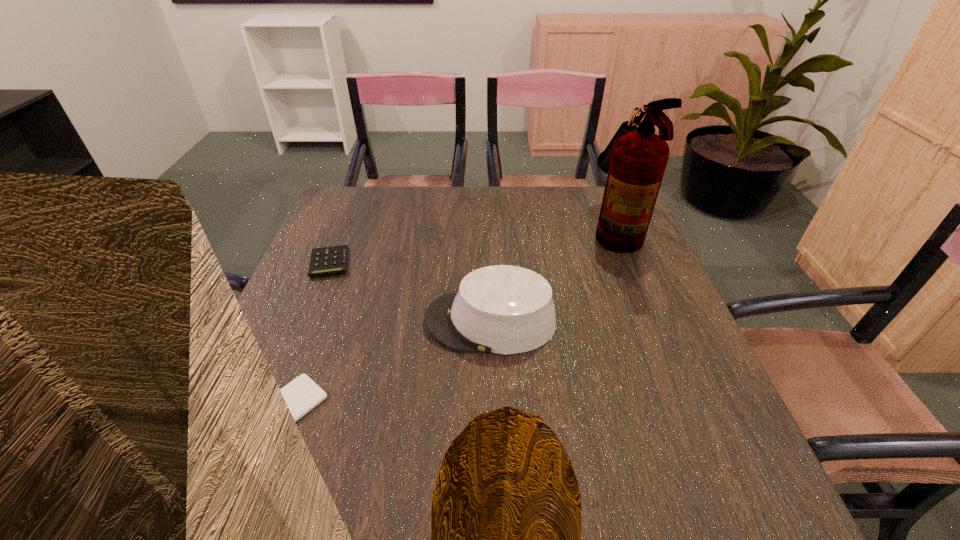
This screenshot has width=960, height=540. What are the coordinates of `vacant space in between the hat and the nearer calculator` in the screenshot? It's located at (390, 364).

This screenshot has height=540, width=960. What are the coordinates of `free space between the second object from right to left and the shortest object` in the screenshot? It's located at (390, 364).

This screenshot has width=960, height=540. What are the coordinates of `vacant region between the taller calculator and the nearest object` in the screenshot? It's located at (309, 334).

Where is `vacant space that's between the rightmost object and the second tallest object`? This screenshot has height=540, width=960. vacant space that's between the rightmost object and the second tallest object is located at coordinates (553, 275).

Locate which object ranks second in proximity to the second shortest object. Please provide its 2D coordinates. Your answer should be formatted as a tuple, i.e. [(x, y)], where the tuple contains the x and y coordinates of a point satisfying the conditions above.

[(302, 394)]

Point out which object is positioned as the nearest to the nearer calculator. Please provide its 2D coordinates. Your answer should be formatted as a tuple, i.e. [(x, y)], where the tuple contains the x and y coordinates of a point satisfying the conditions above.

[(501, 309)]

What are the coordinates of `vacant point that satisfies the following two spatial constraints: 1. at the nozzle of the rightmost object; 2. on the front side of the farther calculator` in the screenshot? It's located at [628, 262].

You are a GUI agent. You are given a task and a screenshot of the screen. Output one action in this format:
    pyautogui.click(x=<x>, y=<y>)
    Task: Click on the free space in the image that satisfies the following two spatial constraints: 1. on the front side of the taller calculator; 2. on the right side of the shortest object
    The height and width of the screenshot is (540, 960).
    Given the screenshot: What is the action you would take?
    pyautogui.click(x=271, y=406)